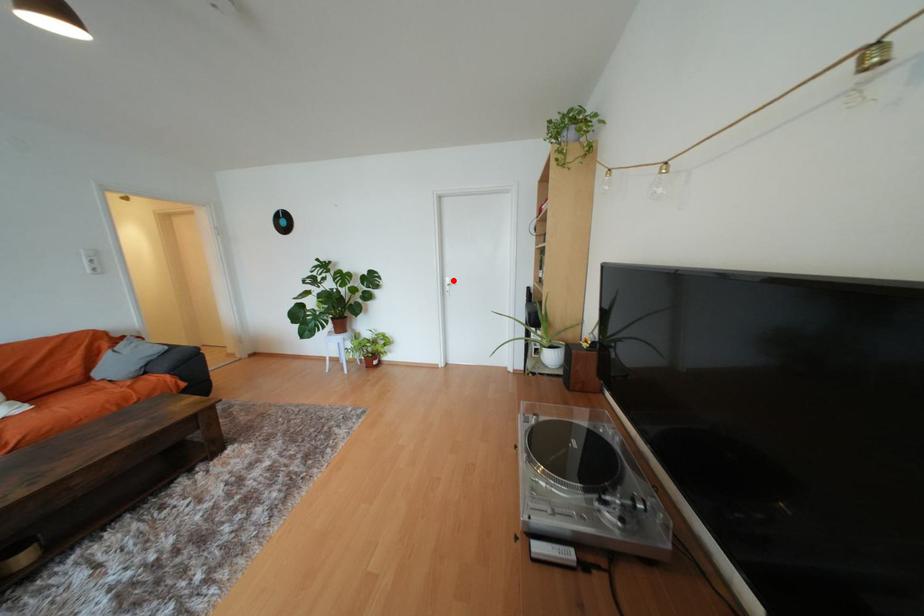
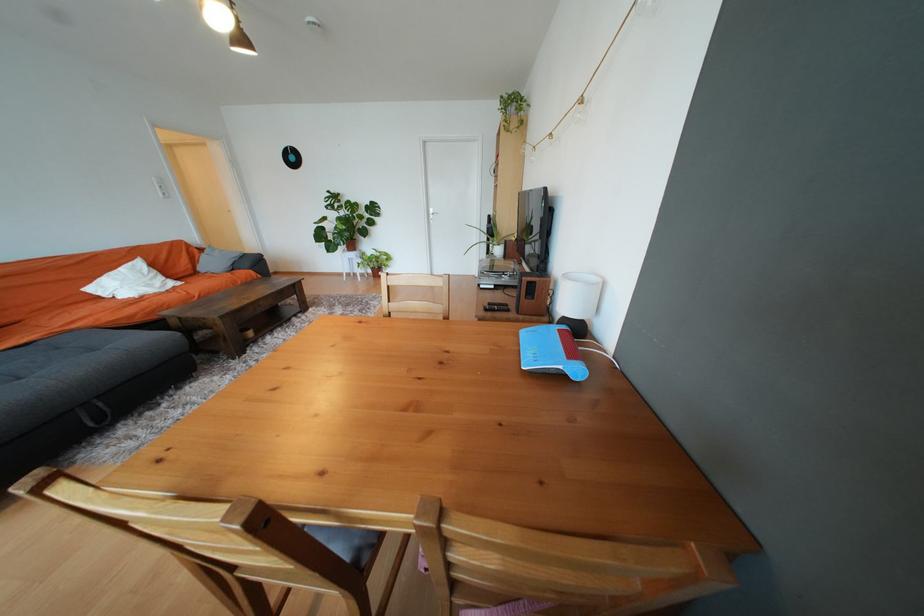
Question: I am providing you with two images of the same scene from different viewpoints. Image1 has a red point marked. In image2, the corresponding 3D location appears at what relative position? Reply with the corresponding letter.

Choices:
 (A) Closer
 (B) Farther

Answer: (A)